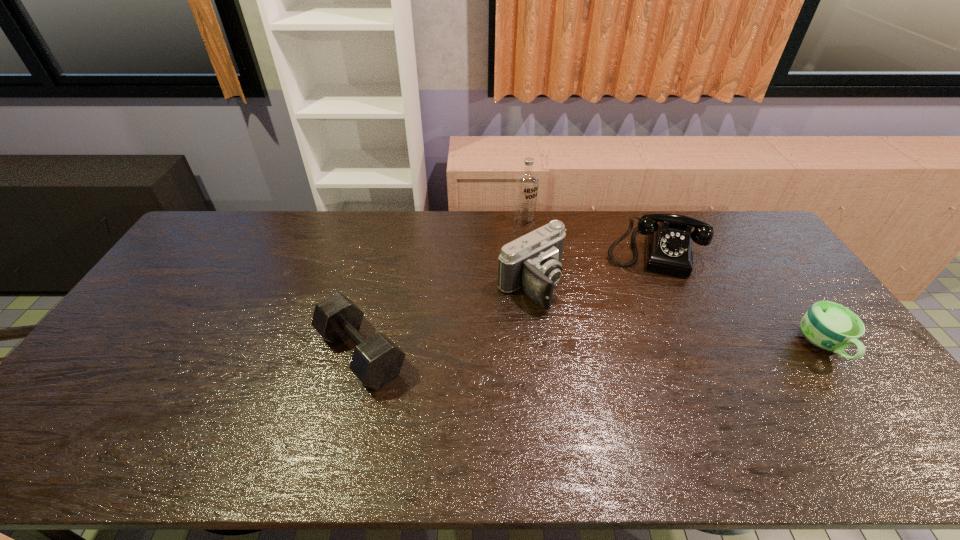
Identify the location of vacant spot on the desktop that is between the dumbbell and the cup and is positioned on the front label of the vodka. (608, 349).

At what (x,y) coordinates should I click in order to perform the action: click on free spot on the desktop that is between the fourth tallest object and the cup and is positioned at the front of the camera with an open lens cover. Please return your answer as a coordinate pair (x, y). This screenshot has height=540, width=960. Looking at the image, I should click on (611, 349).

Where is `vacant spot on the desktop that is between the dumbbell and the cup and is positioned on the dial of the fourth object from left to right`? vacant spot on the desktop that is between the dumbbell and the cup and is positioned on the dial of the fourth object from left to right is located at coordinates (649, 349).